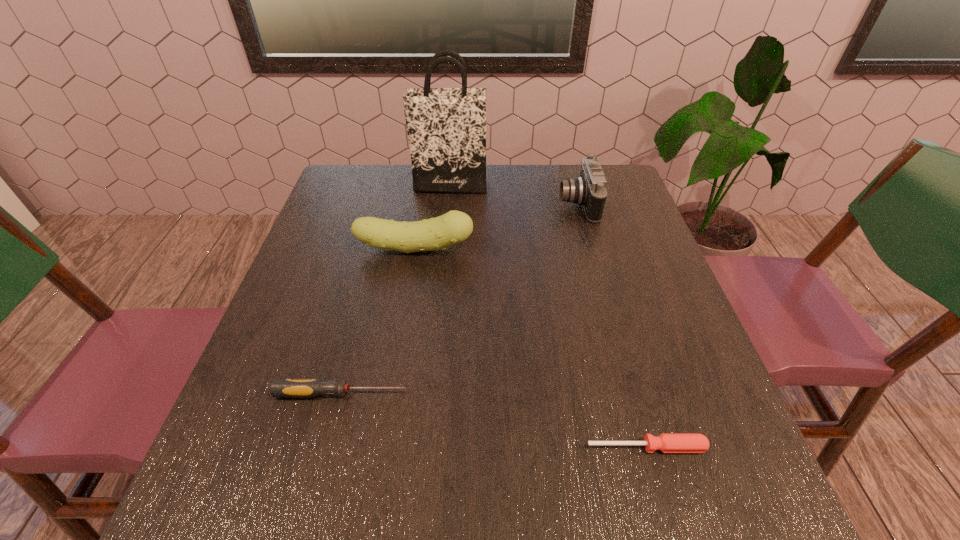
Where is `object situated at the far right corner`? Image resolution: width=960 pixels, height=540 pixels. object situated at the far right corner is located at coordinates (589, 190).

This screenshot has height=540, width=960. Find the location of `vacant space at the far edge of the desktop`. vacant space at the far edge of the desktop is located at coordinates (495, 204).

The height and width of the screenshot is (540, 960). I want to click on vacant area at the near edge, so click(x=372, y=483).

Image resolution: width=960 pixels, height=540 pixels. In order to click on blank area at the left edge in this screenshot , I will do `click(350, 256)`.

Image resolution: width=960 pixels, height=540 pixels. I want to click on free space at the right edge, so click(x=611, y=218).

Find the location of `free space at the far left corner`. free space at the far left corner is located at coordinates (364, 195).

You are a GUI agent. You are given a task and a screenshot of the screen. Output one action in this format:
    pyautogui.click(x=<x>, y=<y>)
    Task: Click on the free location at the near left corner
    
    Given the screenshot: What is the action you would take?
    pyautogui.click(x=267, y=498)

You are a GUI agent. You are given a task and a screenshot of the screen. Output one action in this format:
    pyautogui.click(x=<x>, y=<y>)
    Task: Click on the free space at the far right corner of the desktop
    This screenshot has height=540, width=960.
    Given the screenshot: What is the action you would take?
    pyautogui.click(x=605, y=168)

The height and width of the screenshot is (540, 960). What are the coordinates of `vacant point located between the cucumber and the camera` in the screenshot? It's located at (496, 227).

The image size is (960, 540). Find the location of `vacant space in between the shopping bag and the second shortest object`. vacant space in between the shopping bag and the second shortest object is located at coordinates (396, 289).